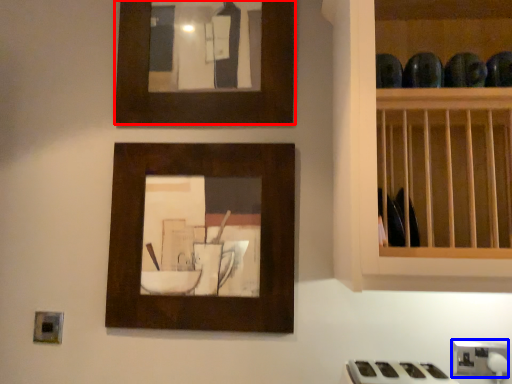
Question: Among these objects, which one is nearest to the camera, picture frame (highlighted by a red box) or electric outlet (highlighted by a blue box)?

Choices:
 (A) picture frame
 (B) electric outlet

Answer: (B)